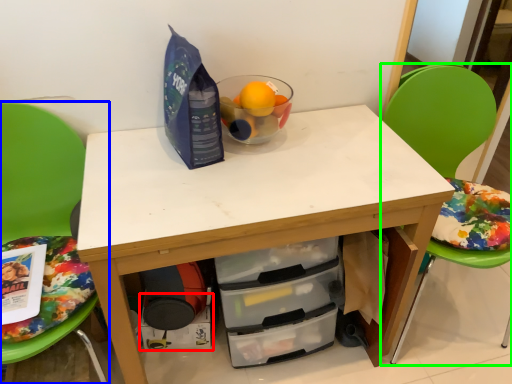
Question: Which is nearer to the drawer (highlighted by a red box)? chair (highlighted by a blue box) or chair (highlighted by a green box).

Choices:
 (A) chair
 (B) chair

Answer: (A)